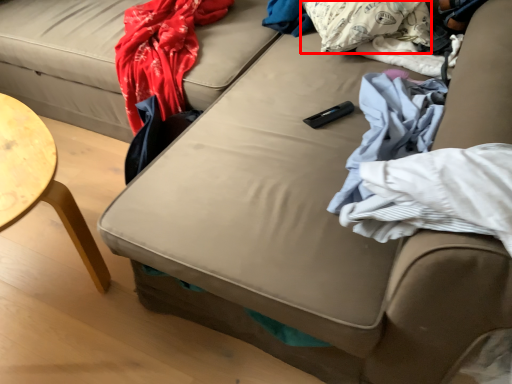
Question: From the image, what is the correct spatial relationship of pillow (annotated by the red box) in relation to material?

Choices:
 (A) right
 (B) left

Answer: (B)